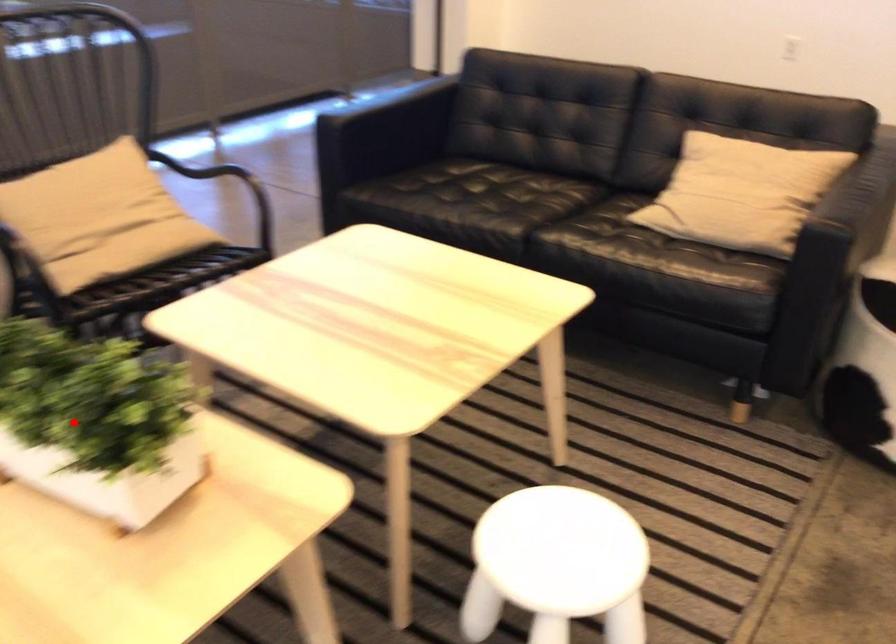
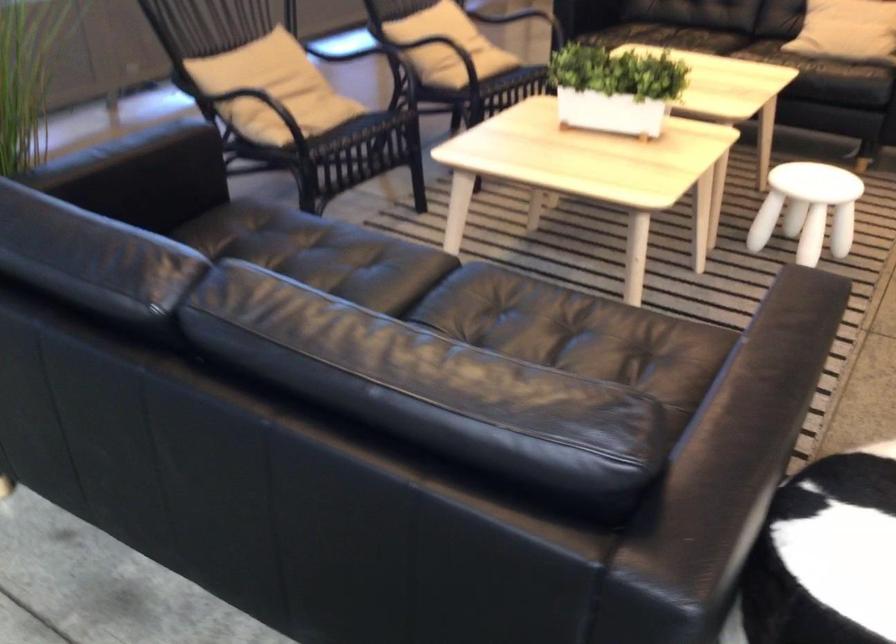
Question: I am providing you with two images of the same scene from different viewpoints. Given a red point in image1, look at the same physical point in image2. Is it:

Choices:
 (A) Closer to the viewpoint
 (B) Farther from the viewpoint

Answer: (B)